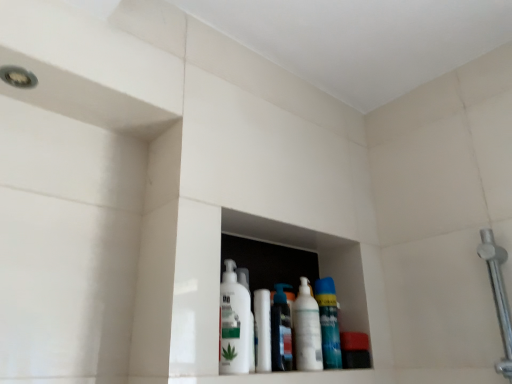
This screenshot has height=384, width=512. What are the coordinates of `white glossy mouthwash at center` in the screenshot? It's located at (262, 331).

Where is `blue glossy spray can at center, acting as the 4th cleaning product starting from the left`? blue glossy spray can at center, acting as the 4th cleaning product starting from the left is located at coordinates (328, 323).

Describe the element at coordinates (234, 323) in the screenshot. I see `white glossy lotion at center, marked as the first cleaning product in a left-to-right arrangement` at that location.

Measure the distance between polished chrome shower arm at right and camera.

polished chrome shower arm at right and camera are 34.69 inches apart from each other.

Identify the location of translucent plastic spray can at center, arranged as the 3th cleaning product when viewed from the right. This screenshot has height=384, width=512. (281, 331).

Find the location of a particular element. The width and height of the screenshot is (512, 384). shower that appears on the right of white glossy mouthwash at center is located at coordinates (x=498, y=296).

Considering their positions, is white glossy mouthwash at center located in front of or behind polished chrome shower arm at right?

Visually, white glossy mouthwash at center is located behind polished chrome shower arm at right.

Consider the image. Who is taller, white glossy mouthwash at center or polished chrome shower arm at right?

With more height is polished chrome shower arm at right.

Which is correct: white glossy mouthwash at center is inside polished chrome shower arm at right, or outside of it?

white glossy mouthwash at center is not inside polished chrome shower arm at right, it's outside.

In the image, is white glossy lotion at center, which appears as the 4th cleaning product when viewed from the right, positioned in front of or behind white glossy bottle at center, which ranks as the third cleaning product in left-to-right order?

white glossy lotion at center, which appears as the 4th cleaning product when viewed from the right, is positioned closer to the viewer than white glossy bottle at center, which ranks as the third cleaning product in left-to-right order.

Which of these two, white glossy lotion at center, which appears as the 4th cleaning product when viewed from the right, or white glossy bottle at center, which is counted as the 2th cleaning product, starting from the right, is wider?

With larger width is white glossy lotion at center, which appears as the 4th cleaning product when viewed from the right.

Is white glossy lotion at center, which appears as the 4th cleaning product when viewed from the right, turned away from white glossy bottle at center, which ranks as the third cleaning product in left-to-right order?

No, white glossy lotion at center, which appears as the 4th cleaning product when viewed from the right,'s orientation is not away from white glossy bottle at center, which ranks as the third cleaning product in left-to-right order.

Is white glossy lotion at center, marked as the first cleaning product in a left-to-right arrangement, at the left side of white glossy bottle at center, which is counted as the 2th cleaning product, starting from the right?

Indeed, white glossy lotion at center, marked as the first cleaning product in a left-to-right arrangement, is positioned on the left side of white glossy bottle at center, which is counted as the 2th cleaning product, starting from the right.

Can you confirm if polished chrome shower arm at right is bigger than white glossy bottle at center, which ranks as the third cleaning product in left-to-right order?

Indeed, polished chrome shower arm at right has a larger size compared to white glossy bottle at center, which ranks as the third cleaning product in left-to-right order.

Which is behind, point (505, 337) or point (320, 352)?

The point (320, 352) is farther from the camera.

From the picture: Between polished chrome shower arm at right and white glossy bottle at center, which is counted as the 2th cleaning product, starting from the right, which one is positioned in front?

Positioned in front is polished chrome shower arm at right.

Is polished chrome shower arm at right placed right next to white glossy bottle at center, which is counted as the 2th cleaning product, starting from the right?

No, polished chrome shower arm at right is not making contact with white glossy bottle at center, which is counted as the 2th cleaning product, starting from the right.

Is translucent plastic spray can at center, arranged as the 3th cleaning product when viewed from the right, at the right side of polished chrome shower arm at right?

Incorrect, translucent plastic spray can at center, arranged as the 3th cleaning product when viewed from the right, is not on the right side of polished chrome shower arm at right.

Does point (280, 317) appear closer or farther from the camera than point (501, 255)?

Point (280, 317) is farther from the camera than point (501, 255).

Which is behind, translucent plastic spray can at center, which is counted as the second cleaning product, starting from the left, or polished chrome shower arm at right?

translucent plastic spray can at center, which is counted as the second cleaning product, starting from the left.

Can you confirm if translucent plastic spray can at center, which is counted as the second cleaning product, starting from the left, is shorter than polished chrome shower arm at right?

Indeed, translucent plastic spray can at center, which is counted as the second cleaning product, starting from the left, has a lesser height compared to polished chrome shower arm at right.

What's the angular difference between white glossy mouthwash at center and translucent plastic spray can at center, arranged as the 3th cleaning product when viewed from the right,'s facing directions?

The angle between the facing direction of white glossy mouthwash at center and the facing direction of translucent plastic spray can at center, arranged as the 3th cleaning product when viewed from the right, is 3.22 degrees.

In terms of height, does white glossy mouthwash at center look taller or shorter compared to translucent plastic spray can at center, which is counted as the second cleaning product, starting from the left?

In the image, white glossy mouthwash at center appears to be shorter than translucent plastic spray can at center, which is counted as the second cleaning product, starting from the left.

From the image's perspective, is white glossy mouthwash at center beneath translucent plastic spray can at center, arranged as the 3th cleaning product when viewed from the right?

No, from the image's perspective, white glossy mouthwash at center is not below translucent plastic spray can at center, arranged as the 3th cleaning product when viewed from the right.

Is white glossy mouthwash at center not inside translucent plastic spray can at center, which is counted as the second cleaning product, starting from the left?

Indeed, white glossy mouthwash at center is completely outside translucent plastic spray can at center, which is counted as the second cleaning product, starting from the left.

From the image's perspective, starting from the blue glossy spray can at center, positioned as the first cleaning product in right-to-left order, which cleaning product is the 2nd one above? Please provide its 2D coordinates.

[(234, 323)]

Looking at this image, from a real-world perspective, is white glossy lotion at center, marked as the first cleaning product in a left-to-right arrangement, positioned above or below blue glossy spray can at center, acting as the 4th cleaning product starting from the left?

From a real-world perspective, white glossy lotion at center, marked as the first cleaning product in a left-to-right arrangement, is physically above blue glossy spray can at center, acting as the 4th cleaning product starting from the left.

Can you tell me how much white glossy lotion at center, which appears as the 4th cleaning product when viewed from the right, and blue glossy spray can at center, positioned as the first cleaning product in right-to-left order, differ in facing direction?

white glossy lotion at center, which appears as the 4th cleaning product when viewed from the right, and blue glossy spray can at center, positioned as the first cleaning product in right-to-left order, are facing 0.861 degrees away from each other.

Is white glossy lotion at center, which appears as the 4th cleaning product when viewed from the right, aimed at polished chrome shower arm at right?

No, white glossy lotion at center, which appears as the 4th cleaning product when viewed from the right, does not turn towards polished chrome shower arm at right.

Who is smaller, white glossy lotion at center, which appears as the 4th cleaning product when viewed from the right, or polished chrome shower arm at right?

white glossy lotion at center, which appears as the 4th cleaning product when viewed from the right, is smaller.

Is point (247, 312) behind point (494, 241)?

No.

Is white glossy lotion at center, marked as the first cleaning product in a left-to-right arrangement, not close to polished chrome shower arm at right?

No, white glossy lotion at center, marked as the first cleaning product in a left-to-right arrangement, is not far away from polished chrome shower arm at right.

I want to click on mouthwash that is behind the polished chrome shower arm at right, so click(x=262, y=331).

Image resolution: width=512 pixels, height=384 pixels. Find the location of `the 2nd cleaning product positioned below the white glossy lotion at center, which appears as the 4th cleaning product when viewed from the right (from a real-world perspective)`. the 2nd cleaning product positioned below the white glossy lotion at center, which appears as the 4th cleaning product when viewed from the right (from a real-world perspective) is located at coordinates (307, 330).

Considering their positions, is white glossy bottle at center, which is counted as the 2th cleaning product, starting from the right, positioned closer to polished chrome shower arm at right than blue glossy spray can at center, positioned as the first cleaning product in right-to-left order?

blue glossy spray can at center, positioned as the first cleaning product in right-to-left order, lies closer to polished chrome shower arm at right than the other object.

When comparing their distances from white glossy mouthwash at center, does blue glossy spray can at center, positioned as the first cleaning product in right-to-left order, or translucent plastic spray can at center, which is counted as the second cleaning product, starting from the left, seem further?

Among the two, blue glossy spray can at center, positioned as the first cleaning product in right-to-left order, is located further to white glossy mouthwash at center.

Based on their spatial positions, is white glossy bottle at center, which ranks as the third cleaning product in left-to-right order, or blue glossy spray can at center, acting as the 4th cleaning product starting from the left, closer to white glossy mouthwash at center?

Among the two, white glossy bottle at center, which ranks as the third cleaning product in left-to-right order, is located nearer to white glossy mouthwash at center.

When comparing their distances from polished chrome shower arm at right, does blue glossy spray can at center, positioned as the first cleaning product in right-to-left order, or white glossy bottle at center, which is counted as the 2th cleaning product, starting from the right, seem further?

Among the two, white glossy bottle at center, which is counted as the 2th cleaning product, starting from the right, is located further to polished chrome shower arm at right.

From the image, which object appears to be nearer to polished chrome shower arm at right, white glossy mouthwash at center or translucent plastic spray can at center, which is counted as the second cleaning product, starting from the left?

Based on the image, translucent plastic spray can at center, which is counted as the second cleaning product, starting from the left, appears to be nearer to polished chrome shower arm at right.

Which object lies nearer to the anchor point white glossy mouthwash at center, polished chrome shower arm at right or translucent plastic spray can at center, which is counted as the second cleaning product, starting from the left?

translucent plastic spray can at center, which is counted as the second cleaning product, starting from the left.

Estimate the real-world distances between objects in this image. Which object is closer to translucent plastic spray can at center, which is counted as the second cleaning product, starting from the left, white glossy mouthwash at center or polished chrome shower arm at right?

Based on the image, white glossy mouthwash at center appears to be nearer to translucent plastic spray can at center, which is counted as the second cleaning product, starting from the left.

Which object lies nearer to the anchor point white glossy lotion at center, marked as the first cleaning product in a left-to-right arrangement, blue glossy spray can at center, positioned as the first cleaning product in right-to-left order, or white glossy mouthwash at center?

white glossy mouthwash at center.

You are a GUI agent. You are given a task and a screenshot of the screen. Output one action in this format:
    pyautogui.click(x=<x>, y=<y>)
    Task: Click on the cleaning product positioned between white glossy lotion at center, which appears as the 4th cleaning product when viewed from the right, and translucent plastic spray can at center, arranged as the 3th cleaning product when viewed from the right, from near to far
    The width and height of the screenshot is (512, 384).
    Given the screenshot: What is the action you would take?
    pyautogui.click(x=307, y=330)

I want to click on cleaning product located between white glossy mouthwash at center and white glossy bottle at center, which is counted as the 2th cleaning product, starting from the right, in the left-right direction, so click(281, 331).

I want to click on mouthwash between white glossy lotion at center, which appears as the 4th cleaning product when viewed from the right, and white glossy bottle at center, which ranks as the third cleaning product in left-to-right order, from left to right, so click(x=262, y=331).

Where is `mouthwash located between white glossy lotion at center, which appears as the 4th cleaning product when viewed from the right, and blue glossy spray can at center, positioned as the first cleaning product in right-to-left order, in the left-right direction`? Image resolution: width=512 pixels, height=384 pixels. mouthwash located between white glossy lotion at center, which appears as the 4th cleaning product when viewed from the right, and blue glossy spray can at center, positioned as the first cleaning product in right-to-left order, in the left-right direction is located at coordinates pos(262,331).